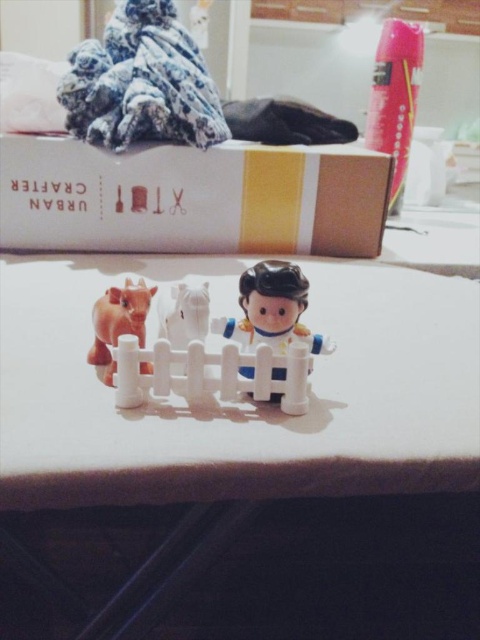
Question: Among these objects, which one is farthest from the camera?

Choices:
 (A) fluffy fabric at upper left
 (B) smooth plastic figure at center

Answer: (A)

Question: Estimate the real-world distances between objects in this image. Which object is farther from the white plastic table at center?

Choices:
 (A) white plastic fence at center
 (B) fluffy fabric at upper left

Answer: (B)

Question: Which is farther from the matte brown cow at left?

Choices:
 (A) white plastic fence at center
 (B) fluffy fabric at upper left
 (C) white plastic table at center

Answer: (B)

Question: Can you confirm if white plastic table at center is wider than smooth plastic figure at center?

Choices:
 (A) yes
 (B) no

Answer: (A)

Question: Observing the image, what is the correct spatial positioning of white plastic table at center in reference to white plastic fence at center?

Choices:
 (A) above
 (B) below

Answer: (B)

Question: Is white plastic table at center wider than fluffy fabric at upper left?

Choices:
 (A) yes
 (B) no

Answer: (A)